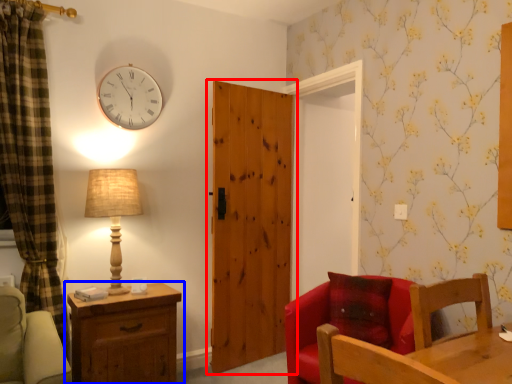
Question: Which of the following is the closest to the observer, door (highlighted by a red box) or chest of drawers (highlighted by a blue box)?

Choices:
 (A) door
 (B) chest of drawers

Answer: (B)